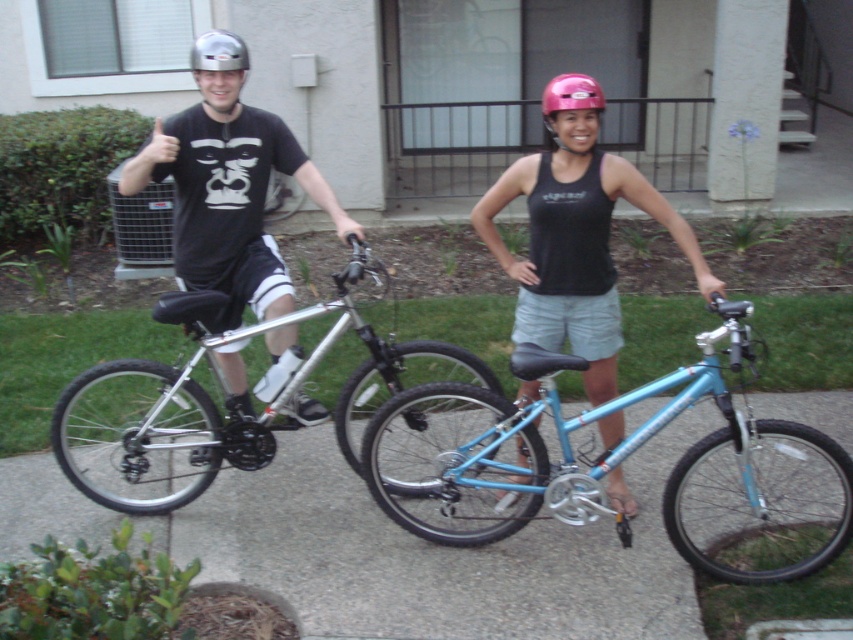
You are a photographer trying to capture both the pink matte helmet at center and the metallic silver helmet at upper left in a single shot. Which helmet is positioned lower in the frame?

The pink matte helmet at center is positioned below the metallic silver helmet at upper left, so it is lower in the frame.

You are a photographer setting up for a group photo. You need to ensure that the light blue metallic bicycle at center is visible in the frame without being blocked by the matte black helmet at upper left. Given their height difference, which object should you adjust to achieve this?

Since the light blue metallic bicycle at center is shorter than the matte black helmet at upper left, you should lower the angle of the camera to ensure the bicycle is visible and not blocked by the helmet.

You are a photographer trying to capture a clear shot of the matte black helmet at upper left and the matte black tank top at center. Which object should you focus on first if you want to ensure both are in focus without adjusting the camera settings?

The matte black helmet at upper left is taller than the matte black tank top at center, so focusing on the taller object first would help ensure both are in focus.